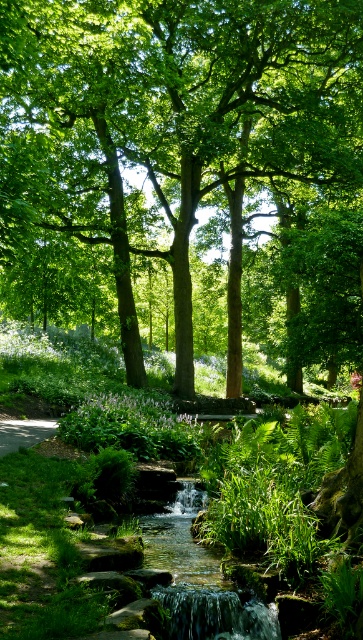
Which is more to the right, green leafy tree at center or smooth concrete path at lower left?

From the viewer's perspective, green leafy tree at center appears more on the right side.

Is green leafy tree at center bigger than smooth concrete path at lower left?

Yes.

Find the location of `green leafy tree at center`. green leafy tree at center is located at coordinates (169, 118).

Locate an element on the screen. green leafy tree at center is located at coordinates (169, 118).